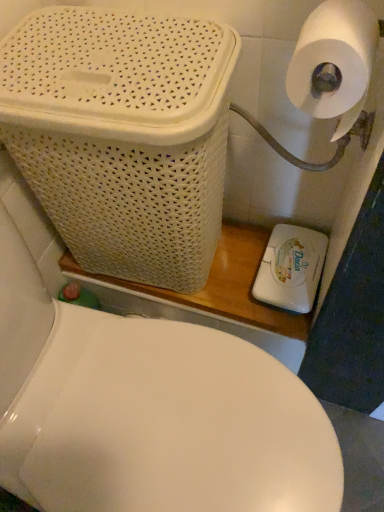
This screenshot has height=512, width=384. I want to click on white glossy toilet at center, so click(x=164, y=423).

Measure the distance between point (247, 477) and camera.

Point (247, 477) is 23.86 inches from camera.

Find the location of a particular element. Image resolution: width=384 pixels, height=512 pixels. white matte toilet paper at upper right is located at coordinates (334, 62).

Measure the distance between point (305, 293) and camera.

The depth of point (305, 293) is 34.65 inches.

Describe the element at coordinates (291, 268) in the screenshot. I see `white plastic soap dispenser at lower right` at that location.

Where is `white glossy toilet at center`? white glossy toilet at center is located at coordinates (164, 423).

From a real-world perspective, which object rests below the other?

white plastic soap dispenser at lower right.

From the image's perspective, does white plastic soap dispenser at lower right appear lower than white wicker basket at upper left?

Yes.

Locate an element on the screen. The width and height of the screenshot is (384, 512). appliance beneath the white wicker basket at upper left (from a real-world perspective) is located at coordinates (291, 268).

From the image's perspective, is white wicker basket at upper left under white glossy toilet at center?

No, from the image's perspective, white wicker basket at upper left is not below white glossy toilet at center.

Which of these two, white wicker basket at upper left or white glossy toilet at center, is wider?

With larger width is white glossy toilet at center.

Where is `toilet on the right of white wicker basket at upper left`? toilet on the right of white wicker basket at upper left is located at coordinates (164, 423).

Is point (61, 218) closer or farther from the camera than point (103, 465)?

Point (61, 218) is positioned farther from the camera compared to point (103, 465).

Is white glossy toilet at center aimed at white wicker basket at upper left?

No, white glossy toilet at center is not turned towards white wicker basket at upper left.

Considering the relative sizes of white glossy toilet at center and white wicker basket at upper left in the image provided, is white glossy toilet at center wider than white wicker basket at upper left?

Indeed, white glossy toilet at center has a greater width compared to white wicker basket at upper left.

How many degrees apart are the facing directions of white glossy toilet at center and white wicker basket at upper left?

They differ by 85.9 degrees in their facing directions.

From the image's perspective, which one is positioned lower, white glossy toilet at center or white wicker basket at upper left?

white glossy toilet at center, from the image's perspective.

From the image's perspective, between white glossy toilet at center and white plastic soap dispenser at lower right, who is located below?

white glossy toilet at center is shown below in the image.

Is white glossy toilet at center positioned beyond the bounds of white plastic soap dispenser at lower right?

Yes, white glossy toilet at center is not within white plastic soap dispenser at lower right.

From the picture: Considering the sizes of objects white glossy toilet at center and white plastic soap dispenser at lower right in the image provided, who is taller, white glossy toilet at center or white plastic soap dispenser at lower right?

With more height is white glossy toilet at center.

Are white glossy toilet at center and white plastic soap dispenser at lower right located far from each other?

No, there isn't a large distance between white glossy toilet at center and white plastic soap dispenser at lower right.

Where is `toilet paper located above the white wicker basket at upper left (from the image's perspective)`? The width and height of the screenshot is (384, 512). toilet paper located above the white wicker basket at upper left (from the image's perspective) is located at coordinates (334, 62).

Relative to white wicker basket at upper left, is white matte toilet paper at upper right in front or behind?

white matte toilet paper at upper right is positioned closer to the viewer than white wicker basket at upper left.

Between white matte toilet paper at upper right and white wicker basket at upper left, which one appears on the right side from the viewer's perspective?

From the viewer's perspective, white matte toilet paper at upper right appears more on the right side.

Measure the distance between white matte toilet paper at upper right and white wicker basket at upper left.

12.03 inches.

From a real-world perspective, which is physically below, white wicker basket at upper left or white matte toilet paper at upper right?

From a 3D spatial view, white wicker basket at upper left is below.

In the scene shown: Is white wicker basket at upper left next to white matte toilet paper at upper right and touching it?

white wicker basket at upper left and white matte toilet paper at upper right are not in contact.

From the image's perspective, between white wicker basket at upper left and white matte toilet paper at upper right, who is located below?

From the image's view, white wicker basket at upper left is below.

Image resolution: width=384 pixels, height=512 pixels. In the image, there is a white matte toilet paper at upper right. In order to click on basket container below it (from the image's perspective) in this screenshot , I will do `click(123, 136)`.

Is white glossy toilet at center wider than white matte toilet paper at upper right?

Correct, the width of white glossy toilet at center exceeds that of white matte toilet paper at upper right.

From a real-world perspective, is white glossy toilet at center positioned above or below white matte toilet paper at upper right?

In terms of real-world spatial position, white glossy toilet at center is below white matte toilet paper at upper right.

Which is more to the left, white glossy toilet at center or white matte toilet paper at upper right?

white glossy toilet at center.

Is white glossy toilet at center positioned behind white matte toilet paper at upper right?

No, white glossy toilet at center is closer to the camera.

Identify the location of basket container on the left of the white plastic soap dispenser at lower right. Image resolution: width=384 pixels, height=512 pixels. (123, 136).

Where is `toilet below the white wicker basket at upper left (from the image's perspective)`? toilet below the white wicker basket at upper left (from the image's perspective) is located at coordinates (164, 423).

When comparing their distances from white wicker basket at upper left, does white plastic soap dispenser at lower right or white matte toilet paper at upper right seem further?

Among the two, white plastic soap dispenser at lower right is located further to white wicker basket at upper left.

Which object lies further to the anchor point white wicker basket at upper left, white glossy toilet at center or white matte toilet paper at upper right?

white matte toilet paper at upper right lies further to white wicker basket at upper left than the other object.

When comparing their distances from white matte toilet paper at upper right, does white wicker basket at upper left or white glossy toilet at center seem closer?

white wicker basket at upper left.

Looking at the image, which one is located further to white plastic soap dispenser at lower right, white glossy toilet at center or white matte toilet paper at upper right?

The object further to white plastic soap dispenser at lower right is white matte toilet paper at upper right.

Which object lies further to the anchor point white plastic soap dispenser at lower right, white wicker basket at upper left or white glossy toilet at center?

white wicker basket at upper left.

Estimate the real-world distances between objects in this image. Which object is closer to white wicker basket at upper left, white glossy toilet at center or white plastic soap dispenser at lower right?

The object closer to white wicker basket at upper left is white glossy toilet at center.

Considering their positions, is white wicker basket at upper left positioned further to white plastic soap dispenser at lower right than white matte toilet paper at upper right?

white matte toilet paper at upper right is positioned further to the anchor white plastic soap dispenser at lower right.

From the image, which object appears to be nearer to white plastic soap dispenser at lower right, white matte toilet paper at upper right or white glossy toilet at center?

The object closer to white plastic soap dispenser at lower right is white glossy toilet at center.

Where is `basket container between white glossy toilet at center and white plastic soap dispenser at lower right along the z-axis`? The height and width of the screenshot is (512, 384). basket container between white glossy toilet at center and white plastic soap dispenser at lower right along the z-axis is located at coordinates (123, 136).

You are a GUI agent. You are given a task and a screenshot of the screen. Output one action in this format:
    pyautogui.click(x=<x>, y=<y>)
    Task: Click on the toilet paper between white glossy toilet at center and white plastic soap dispenser at lower right from front to back
    
    Given the screenshot: What is the action you would take?
    pyautogui.click(x=334, y=62)

The width and height of the screenshot is (384, 512). Find the location of `basket container between white matte toilet paper at upper right and white glossy toilet at center in the vertical direction`. basket container between white matte toilet paper at upper right and white glossy toilet at center in the vertical direction is located at coordinates (123, 136).

At what (x,y) coordinates should I click in order to perform the action: click on basket container located between white matte toilet paper at upper right and white plastic soap dispenser at lower right in the depth direction. Please return your answer as a coordinate pair (x, y). Image resolution: width=384 pixels, height=512 pixels. Looking at the image, I should click on (123, 136).